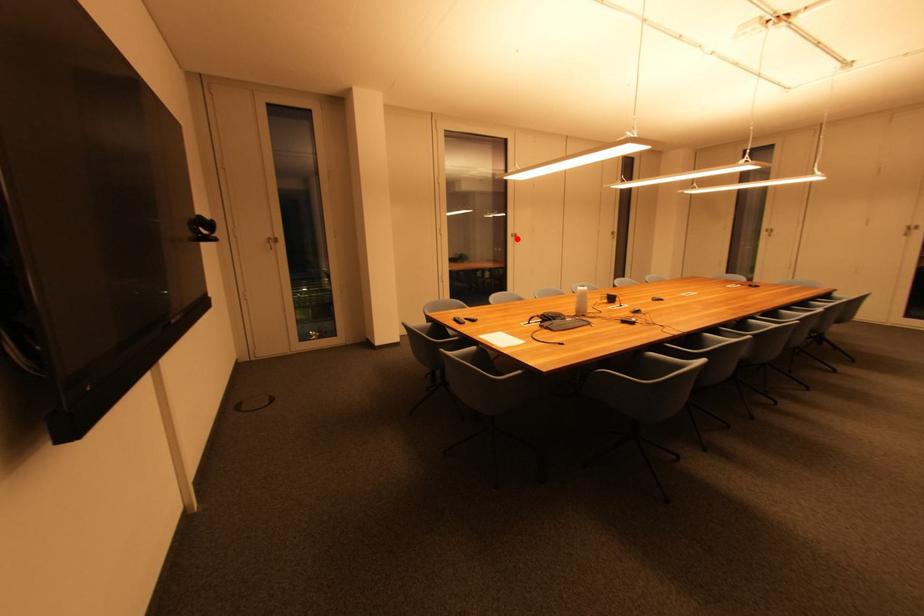
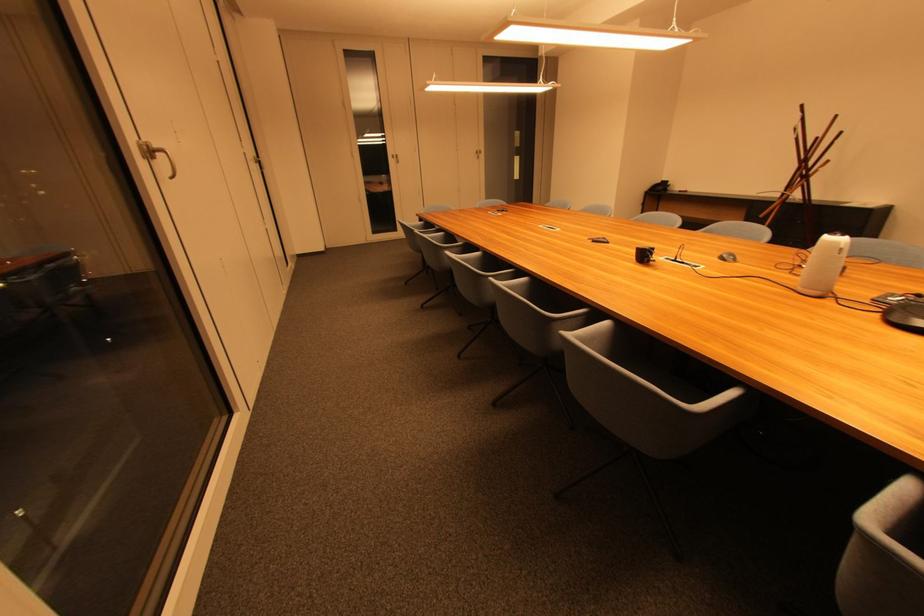
Locate, in the second image, the point that corresponds to the highlighted location in the first image.

(148, 159)